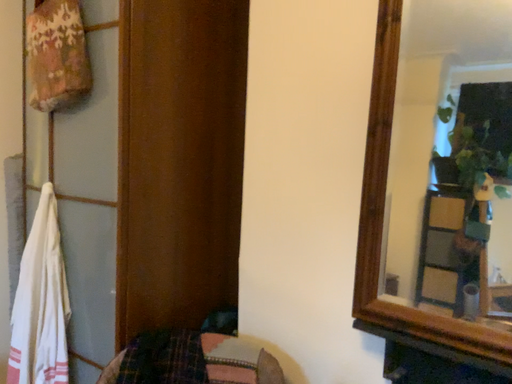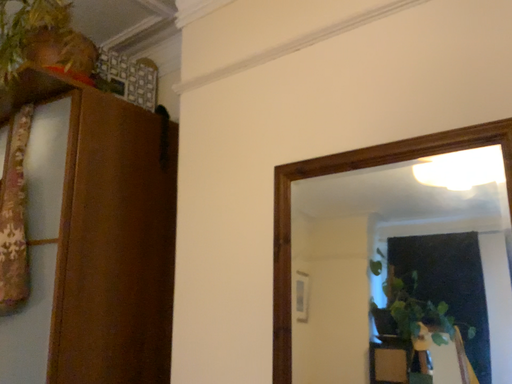
Question: How did the camera likely rotate when shooting the video?

Choices:
 (A) rotated upward
 (B) rotated downward

Answer: (A)